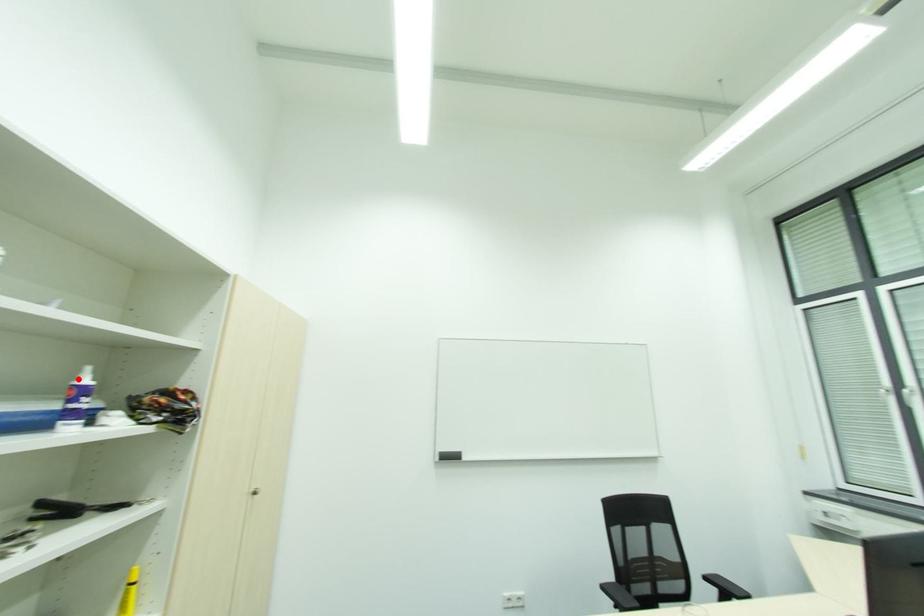
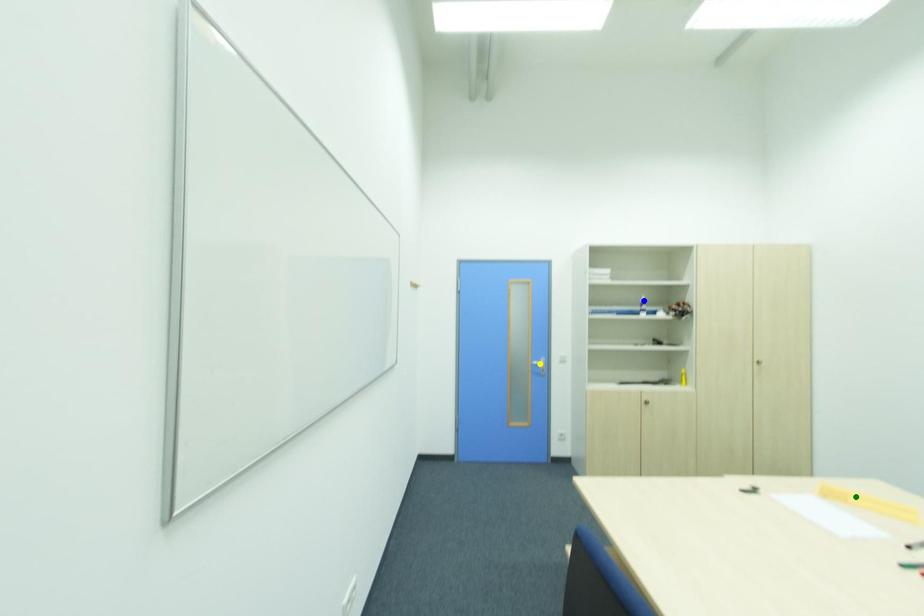
Question: I am providing you with two images of the same scene from different viewpoints. A red point is marked on the first image. You are given multiple points on the second image. Can you choose the point in image 2 that corresponds to the point in image 1?

Choices:
 (A) green point
 (B) yellow point
 (C) blue point

Answer: (C)